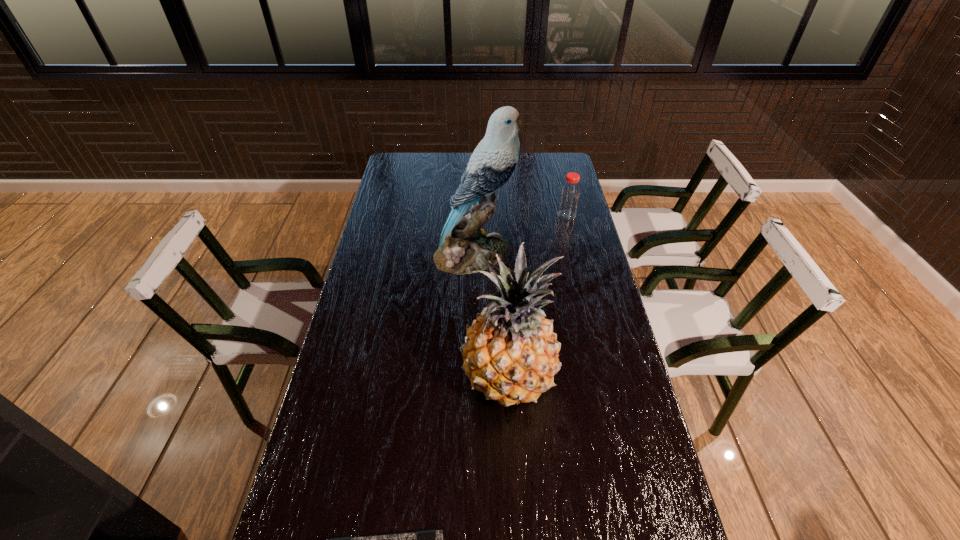
Locate an element on the screen. The image size is (960, 540). free spot at the far edge of the desktop is located at coordinates (443, 168).

What are the coordinates of `vacant space at the left edge of the desktop` in the screenshot? It's located at (414, 224).

Image resolution: width=960 pixels, height=540 pixels. I want to click on free space at the right edge of the desktop, so click(x=557, y=218).

Locate an element on the screen. free spot at the far left corner of the desktop is located at coordinates tap(412, 157).

In the image, there is a desktop. Where is `free space at the far right corner`? This screenshot has width=960, height=540. free space at the far right corner is located at coordinates (549, 177).

Identify the location of free space between the rightmost object and the parakeet. (520, 234).

The image size is (960, 540). What are the coordinates of `blank region between the tallest object and the farthest object` in the screenshot? It's located at (520, 234).

Locate which object is the closest to the third tallest object. Please provide its 2D coordinates. Your answer should be formatted as a tuple, i.e. [(x, y)], where the tuple contains the x and y coordinates of a point satisfying the conditions above.

[(464, 247)]

This screenshot has width=960, height=540. Identify the location of object that stands as the third closest to the second tallest object. (569, 198).

Find the location of a particular element. The image size is (960, 540). free location that satisfies the following two spatial constraints: 1. on the face of the pineapple; 2. on the right side of the tallest object is located at coordinates (472, 378).